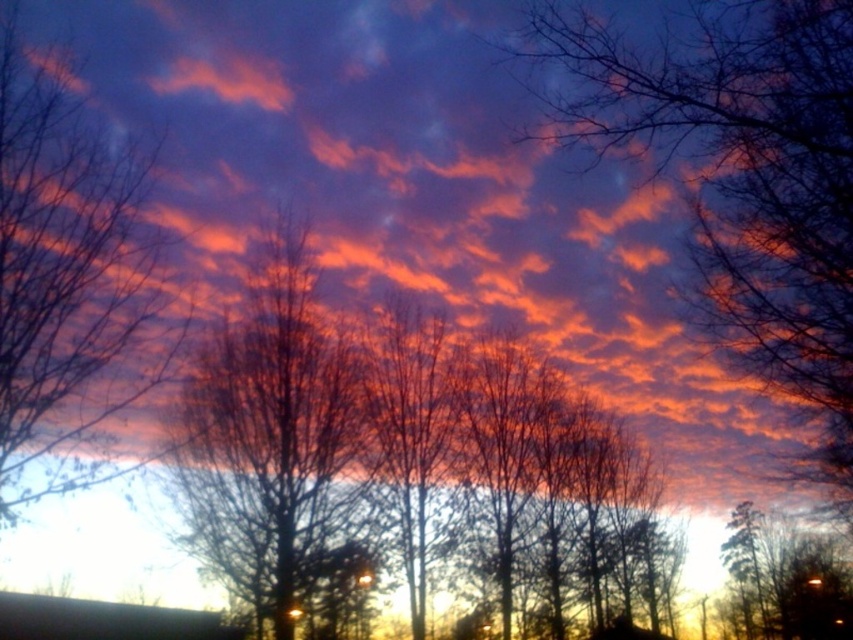
You are a photographer trying to capture the sunset scene. You notice a point at coordinate (741,179) in the image. What object is located at that point?

The point at coordinate (741,179) indicates silhouette bare branches at upper center.